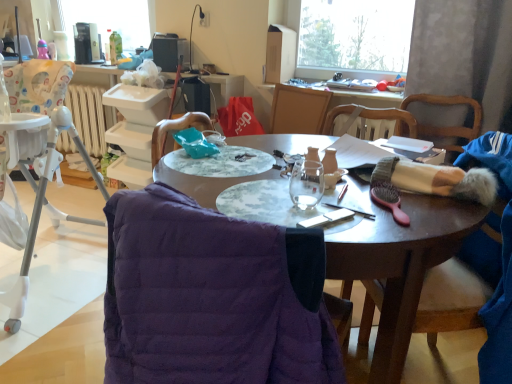
Image resolution: width=512 pixels, height=384 pixels. I want to click on free space in front of black plastic pen at center, so click(x=365, y=230).